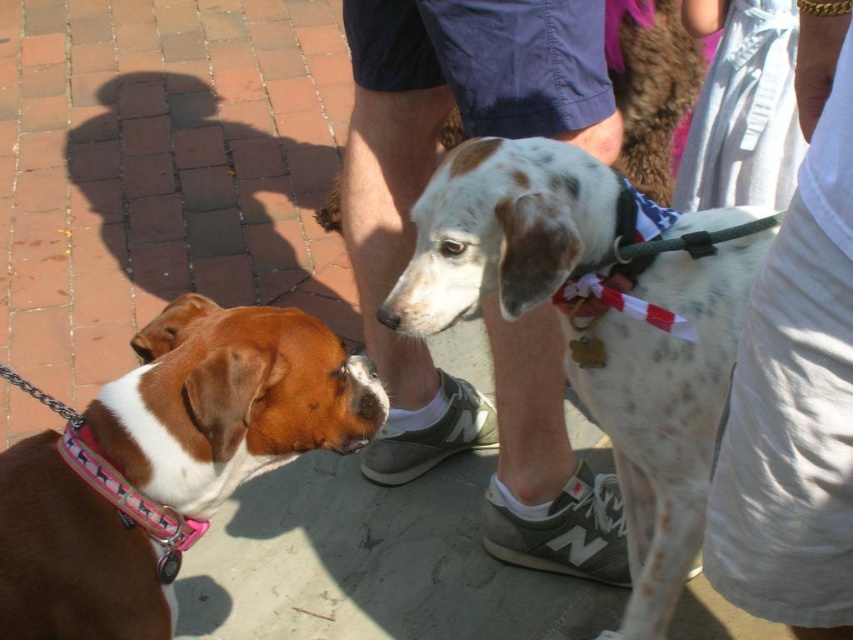
You are a tailor who needs to determine which item requires more fabric for repairs. Based on the scene, which item has a larger size between the white cotton shirt at right and the pink fabric neckband at lower left?

The white cotton shirt at right has a larger size compared to the pink fabric neckband at lower left, so it requires more fabric for repairs.

You are a photographer standing in the middle of the sidewalk. You need to capture a photo that includes both the white cotton shirt at right and the pink fabric neckband at lower left. Which object should you adjust your camera angle to focus on first to ensure both are in frame?

The white cotton shirt at right is positioned over the pink fabric neckband at lower left, so you should focus on the pink fabric neckband at lower left first to ensure both are visible in the frame.

You are standing on the sidewalk and see two points marked in the image. The first point is at coordinates point [566,182] and the second is at point [114,499]. Which point is closer to you?

Point [566,182] is further to the camera than point [114,499], so the point closer to you is point [114,499].